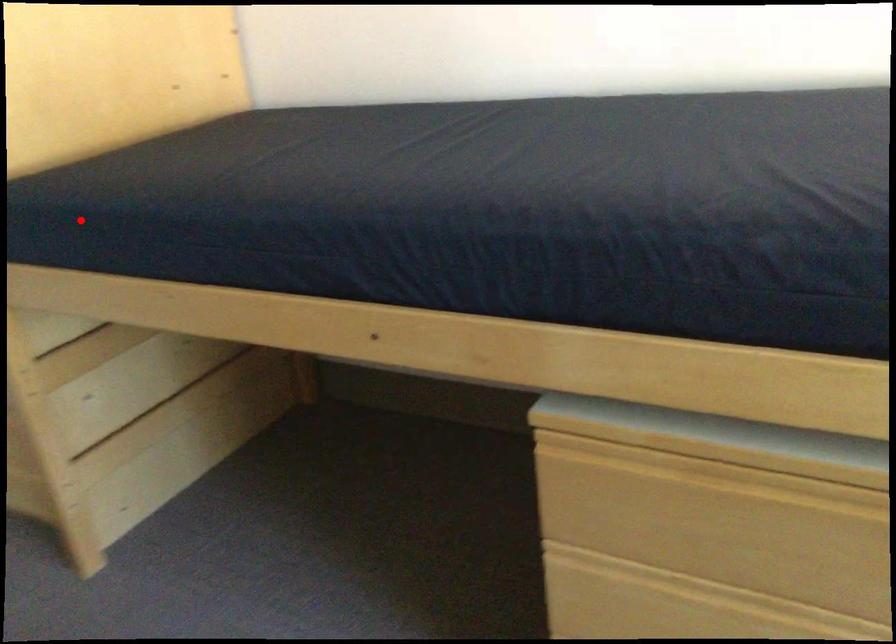
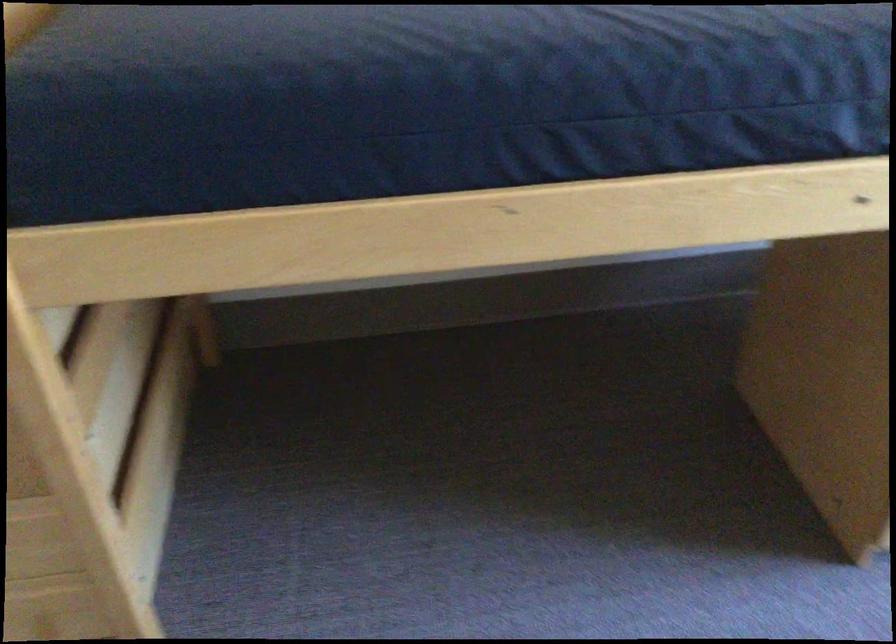
Locate, in the second image, the point that corresponds to the highlighted location in the first image.

(280, 106)